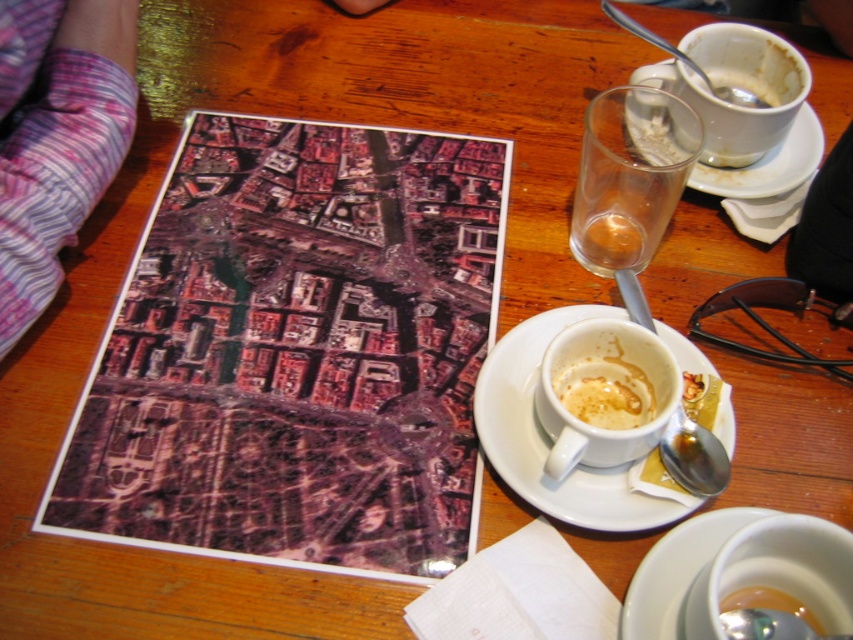
Is transparent glass at upper right wider than matte white cup at center?

Correct, the width of transparent glass at upper right exceeds that of matte white cup at center.

The image size is (853, 640). In order to click on transparent glass at upper right in this screenshot , I will do `click(630, 182)`.

Is purple striped socks at lower left further to the viewer compared to matte white cup at center?

No, purple striped socks at lower left is closer to the viewer.

Between point (6, 48) and point (606, 369), which one is positioned in front?

Point (6, 48) is more forward.

At what (x,y) coordinates should I click in order to perform the action: click on purple striped socks at lower left. Please return your answer as a coordinate pair (x, y). The image size is (853, 640). Looking at the image, I should click on (56, 136).

Who is lower down, white ceramic saucer at upper right or white matte cup at upper right?

white ceramic saucer at upper right is below.

Is point (689, 173) more distant than point (751, 100)?

That is False.

Who is more distant from viewer, (x=699, y=170) or (x=721, y=99)?

Positioned behind is point (x=699, y=170).

Identify the location of white ceramic saucer at upper right. The image size is (853, 640). (769, 163).